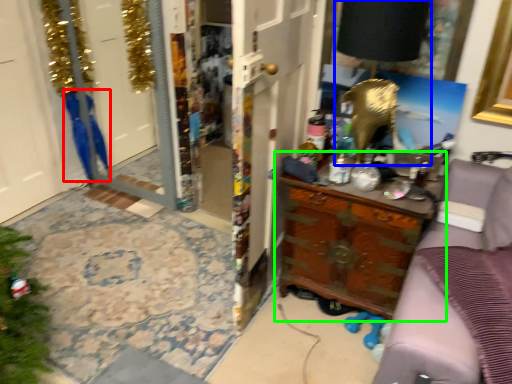
Question: Considering the real-world distances, which object is closest to robe (highlighted by a red box)? lamp (highlighted by a blue box) or chest of drawers (highlighted by a green box).

Choices:
 (A) lamp
 (B) chest of drawers

Answer: (B)